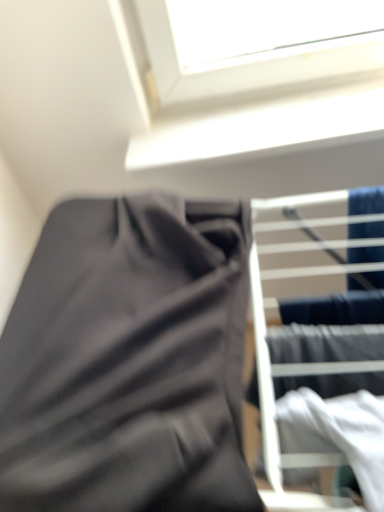
Identify the location of matte black fabric at center. (128, 361).

This screenshot has width=384, height=512. Describe the element at coordinates (128, 361) in the screenshot. I see `matte black fabric at center` at that location.

In order to click on matte black fabric at center in this screenshot , I will do `click(128, 361)`.